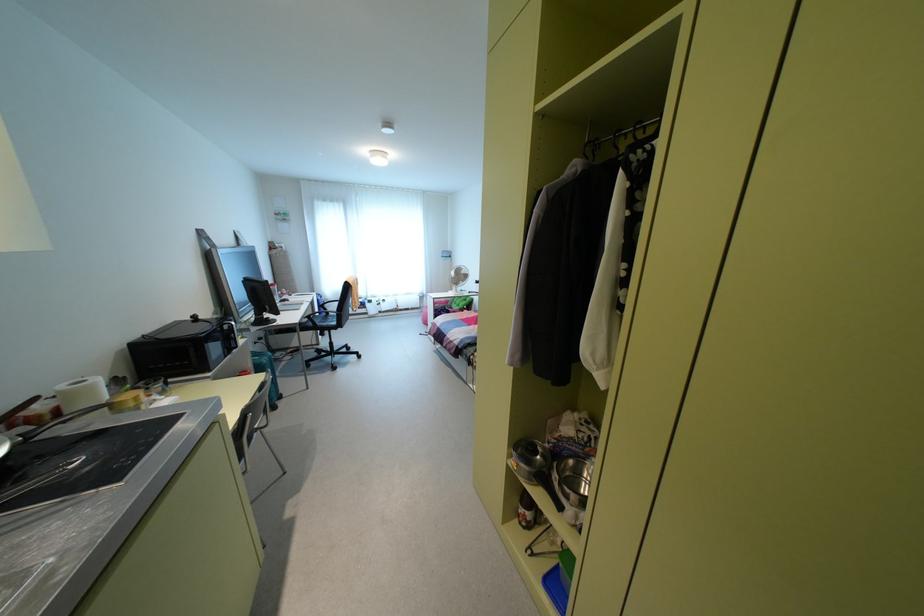
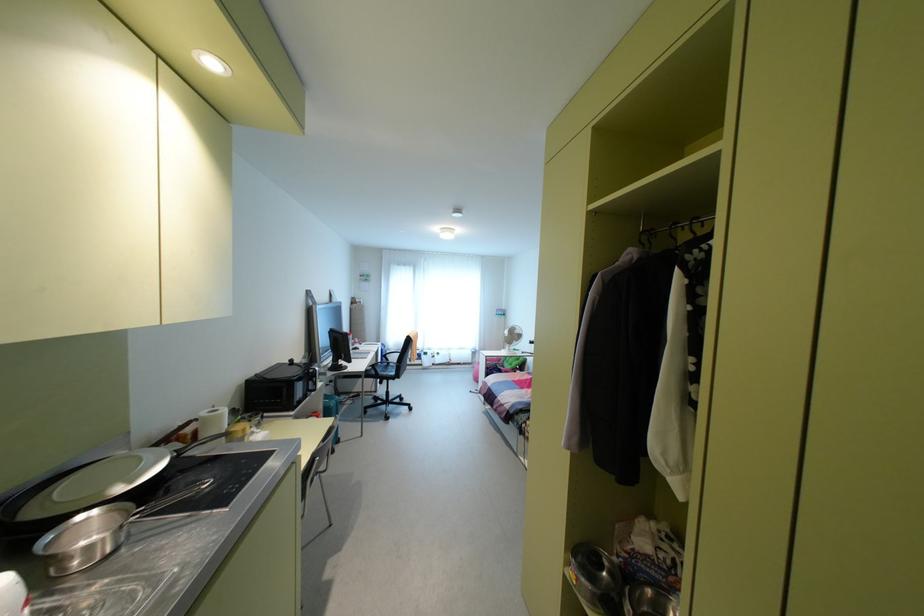
Question: The camera is either moving clockwise (left) or counter-clockwise (right) around the object. The first image is from the beginning of the video and the second image is from the end. Is the camera moving left or right when shooting the video?

Choices:
 (A) Left
 (B) Right

Answer: (B)